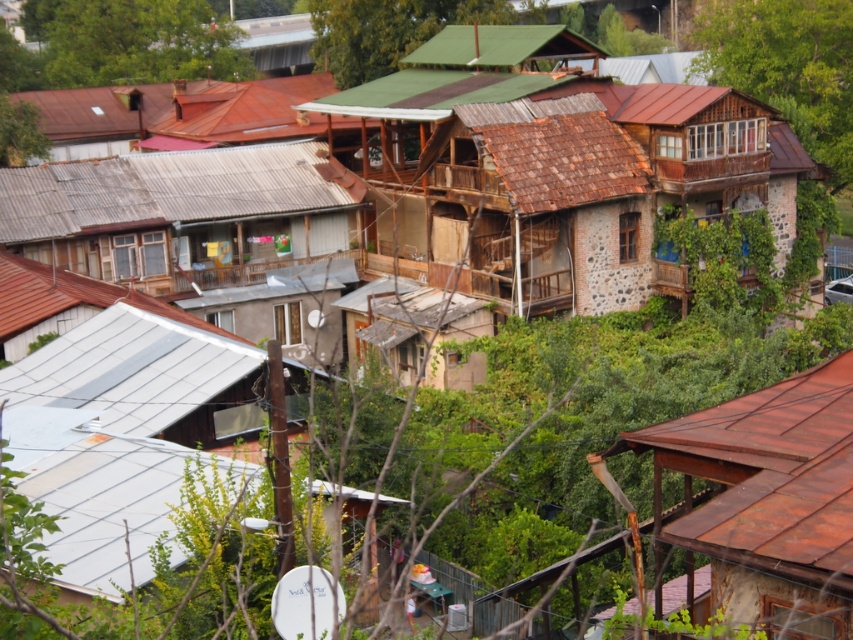
Looking at this image, which is above, green wood tree at upper right or green matte roof at upper center?

green matte roof at upper center is above.

Is green wood tree at upper right taller than green matte roof at upper center?

Correct, green wood tree at upper right is much taller as green matte roof at upper center.

Identify the location of green wood tree at upper right. Image resolution: width=853 pixels, height=640 pixels. (788, 67).

Which is in front, point (65, 221) or point (51, 4)?

Point (65, 221) is more forward.

Who is shorter, gray corrugated metal roof at center-left or green leafy tree at upper center?

gray corrugated metal roof at center-left is shorter.

Which is in front, point (96, 220) or point (154, 10)?

Point (96, 220)

This screenshot has width=853, height=640. I want to click on gray corrugated metal roof at center-left, so click(x=161, y=188).

Does rusty wood house at center come in front of green wood tree at upper right?

Yes, rusty wood house at center is in front of green wood tree at upper right.

Who is positioned more to the left, rusty wood house at center or green wood tree at upper right?

rusty wood house at center is more to the left.

Between point (515, 122) and point (722, 13), which one is positioned behind?

The point (722, 13) is more distant.

Where is `rusty wood house at center`? This screenshot has height=640, width=853. rusty wood house at center is located at coordinates (560, 168).